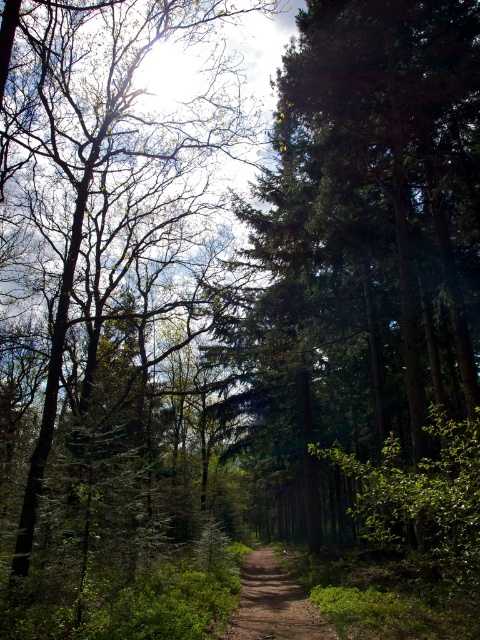
Describe the element at coordinates (113, 320) in the screenshot. This screenshot has width=480, height=640. I see `green leafy tree at center` at that location.

Does green leafy tree at center appear on the left side of dirt path at center?

Correct, you'll find green leafy tree at center to the left of dirt path at center.

Find the location of a particular element. This screenshot has width=480, height=640. green leafy tree at center is located at coordinates (113, 320).

The height and width of the screenshot is (640, 480). I want to click on green leafy tree at center, so click(113, 320).

Between green textured tree at center and dirt path at center, which one appears on the right side from the viewer's perspective?

From the viewer's perspective, green textured tree at center appears more on the right side.

Locate an element on the screen. The height and width of the screenshot is (640, 480). green textured tree at center is located at coordinates (362, 241).

Does green leafy tree at center have a smaller size compared to green textured tree at center?

No, green leafy tree at center is not smaller than green textured tree at center.

Which is below, green leafy tree at center or green textured tree at center?

green textured tree at center is below.

Identify the location of green leafy tree at center. The image size is (480, 640). (113, 320).